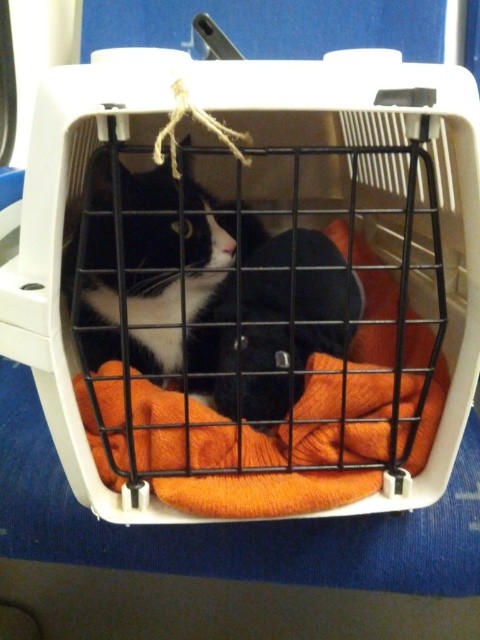
Based on the photo, you are trying to decide whether to place a small plant pot on top of the orange knitted laundry basket at center. Based on the height of the black matte fur cat at center, do you think the basket is tall enough to support the pot without it being knocked over easily?

The orange knitted laundry basket at center is taller than the black matte fur cat at center. Since the cat is at center and the basket is also at center, the basket likely provides sufficient height to place the plant pot on top without the cat easily knocking it over.

From the picture: You are trying to reach the orange knitted laundry basket at center to retrieve a sock. However, there is a black matte fur cat at center in the way. Based on their positions, can you easily access the basket without disturbing the cat?

The orange knitted laundry basket at center is above the black matte fur cat at center, so you can reach the basket without disturbing the cat by going around or over the cat.

In the scene shown: You are looking at the image of the cat in the carrier. There are two points marked in the image. From your perspective, which point is closer to you, point (216, 81) or point (81, 346)?

Point (216, 81) is in front of point (81, 346), so it is closer to you.